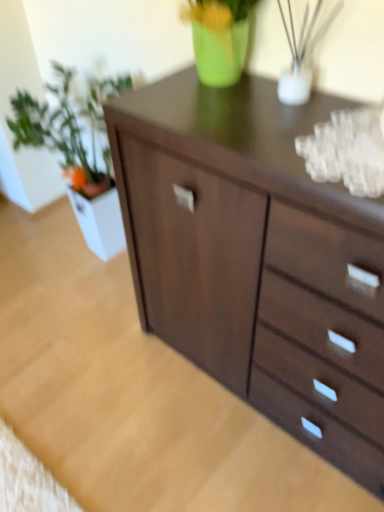
Locate an element on the screen. Image resolution: width=384 pixels, height=512 pixels. free region under green matte plant at left (from a real-world perspective) is located at coordinates (77, 264).